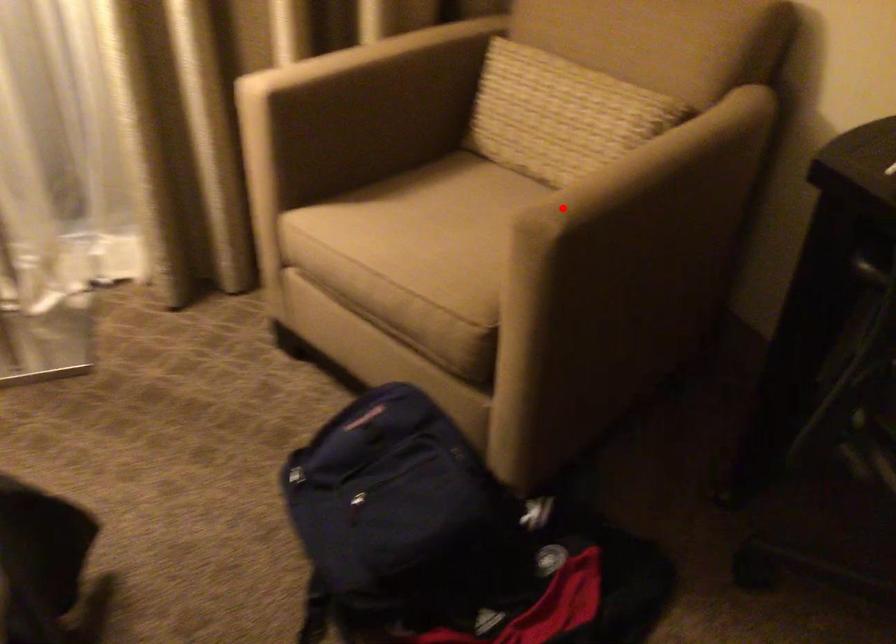
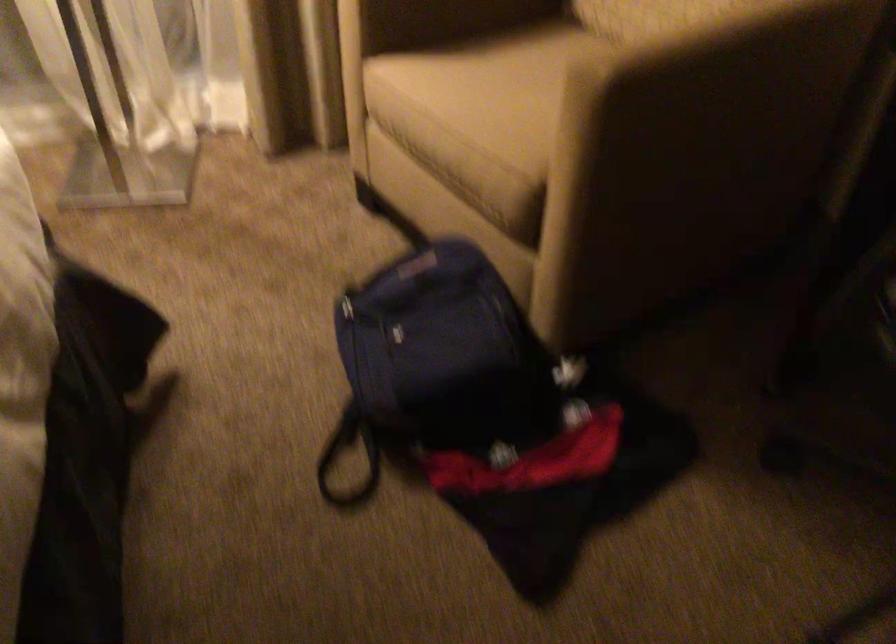
Where in the second image is the point corresponding to the highlighted location from the first image?

(617, 53)